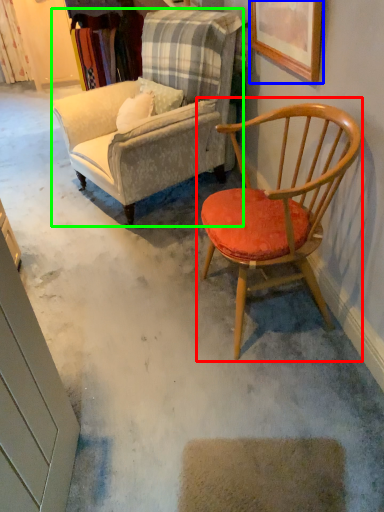
Question: Estimate the real-world distances between objects in this image. Which object is closer to chair (highlighted by a red box), picture frame (highlighted by a blue box) or chair (highlighted by a green box)?

Choices:
 (A) picture frame
 (B) chair

Answer: (A)